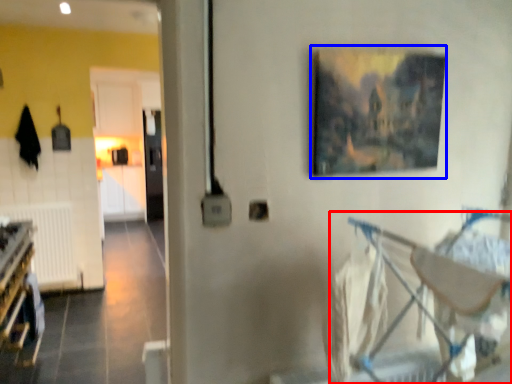
Question: Among these objects, which one is farthest to the camera, baby carriage (highlighted by a red box) or picture frame (highlighted by a blue box)?

Choices:
 (A) baby carriage
 (B) picture frame

Answer: (B)